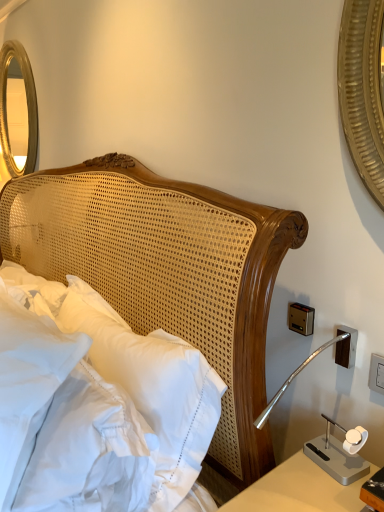
Where is `free spot above gold metallic mirror at upper left (from a real-world perspective)`? The image size is (384, 512). free spot above gold metallic mirror at upper left (from a real-world perspective) is located at coordinates (x=13, y=36).